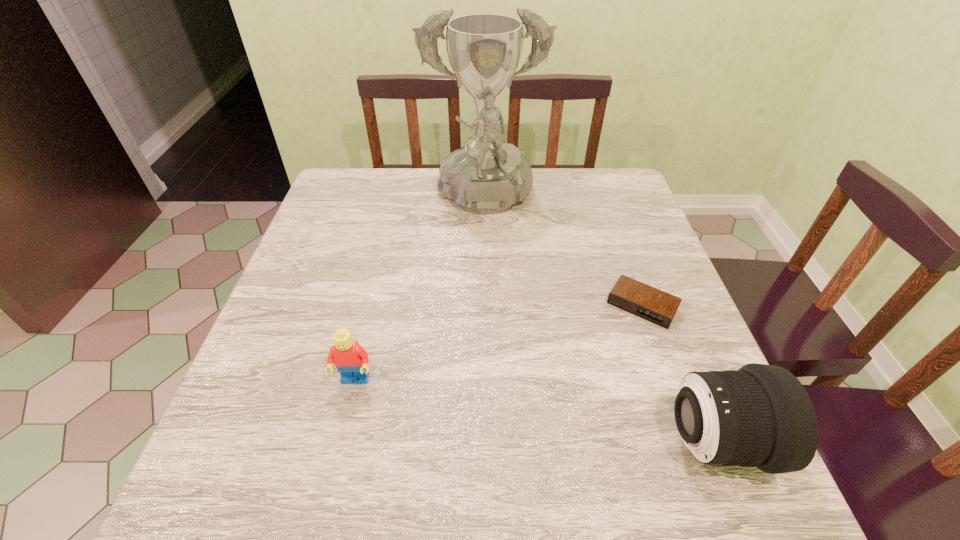
Identify the location of free space between the second object from left to right and the alarm clock. This screenshot has width=960, height=540. (563, 254).

Identify the location of blank region between the award and the second nearest object. The image size is (960, 540). tap(420, 291).

Identify the location of empty location between the nearest object and the tallest object. (599, 322).

Image resolution: width=960 pixels, height=540 pixels. In order to click on free spot between the third farthest object and the alarm clock in this screenshot , I will do `click(498, 343)`.

Where is `vacant point located between the farthest object and the third nearest object`? vacant point located between the farthest object and the third nearest object is located at coordinates (563, 254).

The image size is (960, 540). Identify the location of the closest object to the third object from right to left. pyautogui.click(x=656, y=306).

Identify the location of the closest object to the third farthest object. (486, 176).

Identify the location of free spot that satisfies the following two spatial constraints: 1. on the face of the third tallest object; 2. at the front element of the telephoto lens. The image size is (960, 540). (341, 441).

Identify the location of vacant position in the image that satisfies the following two spatial constraints: 1. on the face of the nearest object; 2. at the front element of the second nearest object. (341, 441).

I want to click on vacant point that satisfies the following two spatial constraints: 1. on the face of the leftmost object; 2. at the front element of the telephoto lens, so click(341, 441).